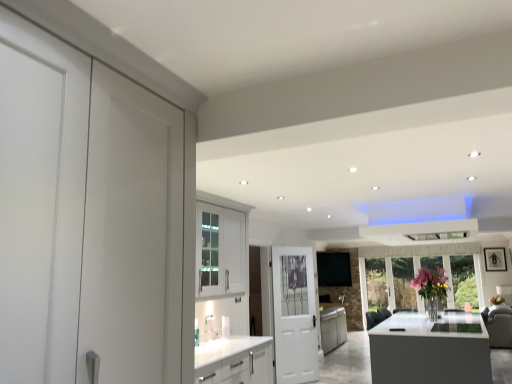
Question: From the image's perspective, is white glossy door at center located beneath pink glass vase at center?

Choices:
 (A) no
 (B) yes

Answer: (B)

Question: Is pink glass vase at center completely or partially inside white glossy door at center?

Choices:
 (A) yes
 (B) no

Answer: (B)

Question: Is white glossy door at center outside of pink glass vase at center?

Choices:
 (A) no
 (B) yes

Answer: (B)

Question: From a real-world perspective, is white glossy door at center located beneath pink glass vase at center?

Choices:
 (A) no
 (B) yes

Answer: (B)

Question: Can you confirm if white glossy door at center is positioned to the left of pink glass vase at center?

Choices:
 (A) yes
 (B) no

Answer: (A)

Question: From a real-world perspective, does white glossy door at center stand above pink glass vase at center?

Choices:
 (A) yes
 (B) no

Answer: (B)

Question: Does pink glass vase at center have a greater width compared to white glossy door at center?

Choices:
 (A) no
 (B) yes

Answer: (B)

Question: Is pink glass vase at center outside of white glossy door at center?

Choices:
 (A) yes
 (B) no

Answer: (A)

Question: Can you confirm if pink glass vase at center is thinner than white glossy door at center?

Choices:
 (A) yes
 (B) no

Answer: (B)

Question: Does pink glass vase at center come behind white glossy door at center?

Choices:
 (A) yes
 (B) no

Answer: (B)

Question: Could you tell me if pink glass vase at center is turned towards white glossy door at center?

Choices:
 (A) no
 (B) yes

Answer: (B)

Question: Is pink glass vase at center taller than white glossy door at center?

Choices:
 (A) yes
 (B) no

Answer: (B)

Question: Based on their sizes in the image, would you say white glossy door at center is bigger or smaller than pink glass vase at center?

Choices:
 (A) small
 (B) big

Answer: (B)